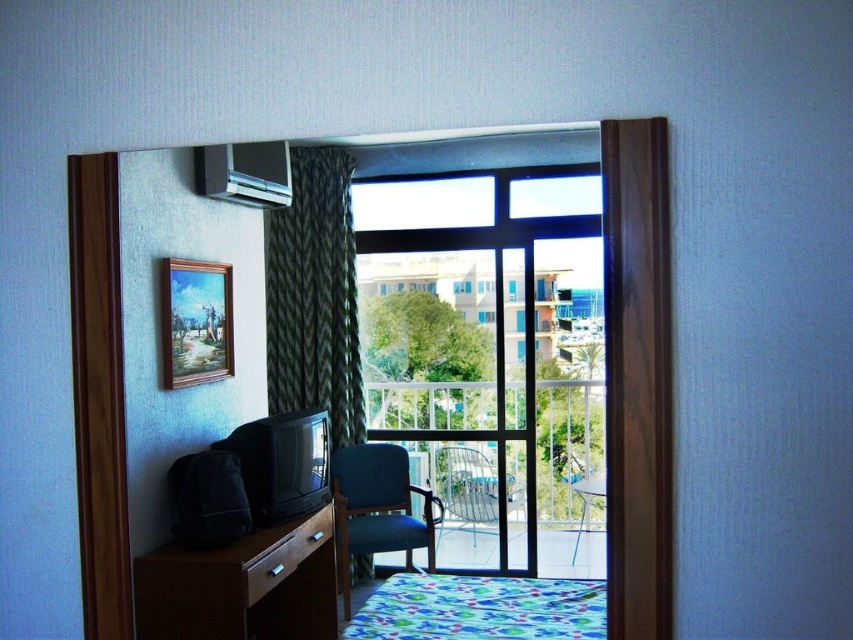
Question: Which of these objects is positioned closest to the brown wood table at lower left?

Choices:
 (A) clear glass door at center
 (B) transparent glass terrace at center
 (C) transparent glass window at center
 (D) metallic silver table at center

Answer: (B)

Question: Can you confirm if blue fabric armchair at center is positioned above metallic silver table at center?

Choices:
 (A) no
 (B) yes

Answer: (B)

Question: Where is clear glass door at center located in relation to transparent glass terrace at center in the image?

Choices:
 (A) right
 (B) left

Answer: (A)

Question: Which object is closer to the camera taking this photo?

Choices:
 (A) green zigzag fabric curtain at center
 (B) brown wood table at lower left
 (C) clear glass door at center
 (D) metallic silver table at center

Answer: (B)

Question: Which is farther from the transparent glass terrace at center?

Choices:
 (A) green zigzag fabric curtain at center
 (B) metallic silver table at center

Answer: (B)

Question: Is green zigzag fabric curtain at center in front of blue fabric armchair at center?

Choices:
 (A) yes
 (B) no

Answer: (B)